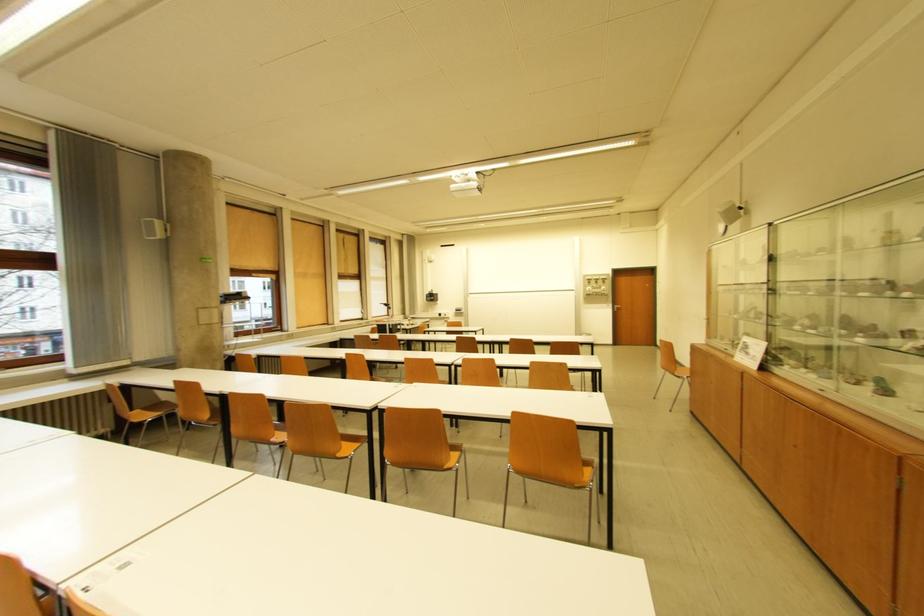
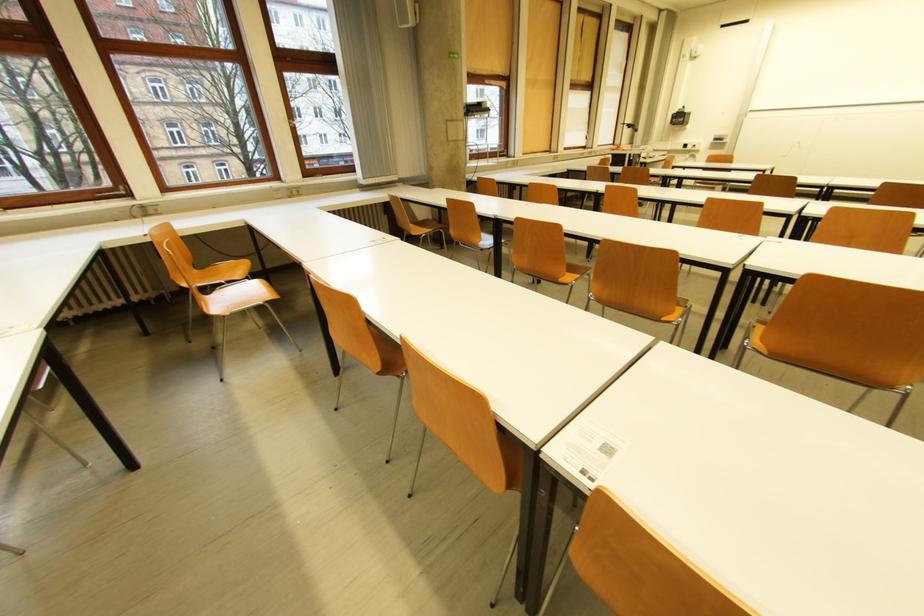
The point at (446, 315) is marked in the first image. Where is the corresponding point in the second image?

(691, 147)